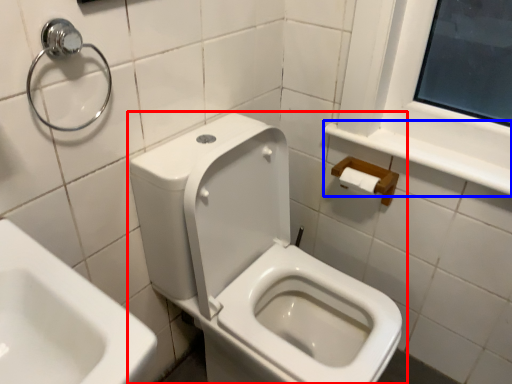
Question: Among these objects, which one is farthest to the camera, toilet (highlighted by a red box) or balustrade (highlighted by a blue box)?

Choices:
 (A) toilet
 (B) balustrade

Answer: (B)